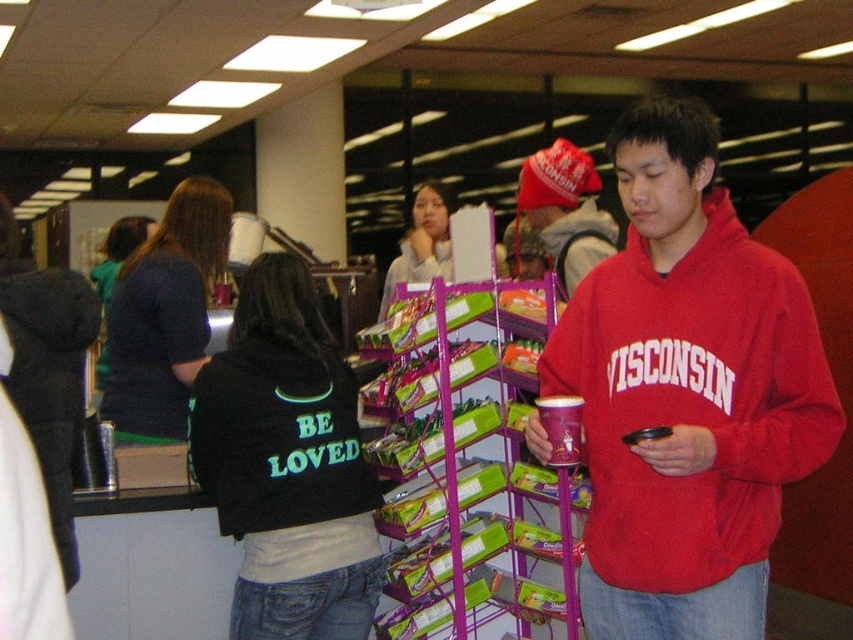
You are a delivery robot that is 0.5 meters wide. You need to move from the dark blue sweater at center to the matte red beanie at upper center. Is there enough space between them for you to pass through?

The dark blue sweater at center and matte red beanie at upper center are 1.21 meters apart from each other. Since the robot is 0.5 meters wide, there is sufficient space between them for the robot to pass through.

You are standing in the store and want to reach the dark blue sweater at center without moving the black fleece jacket at center. Is this possible?

The black fleece jacket at center is below dark blue sweater at center, so you can reach the dark blue sweater at center by moving around the black fleece jacket at center since it is positioned lower.